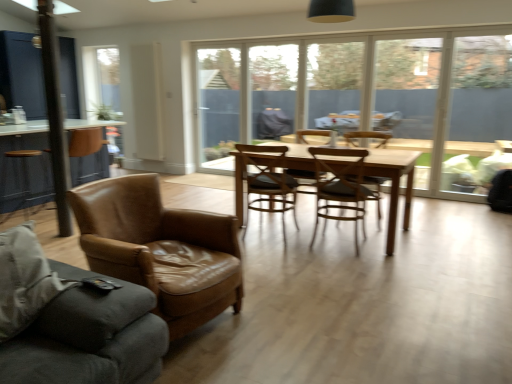
Identify the location of space that is in front of brown leather chair at center, which is the 3th chair from front to back. (283, 253).